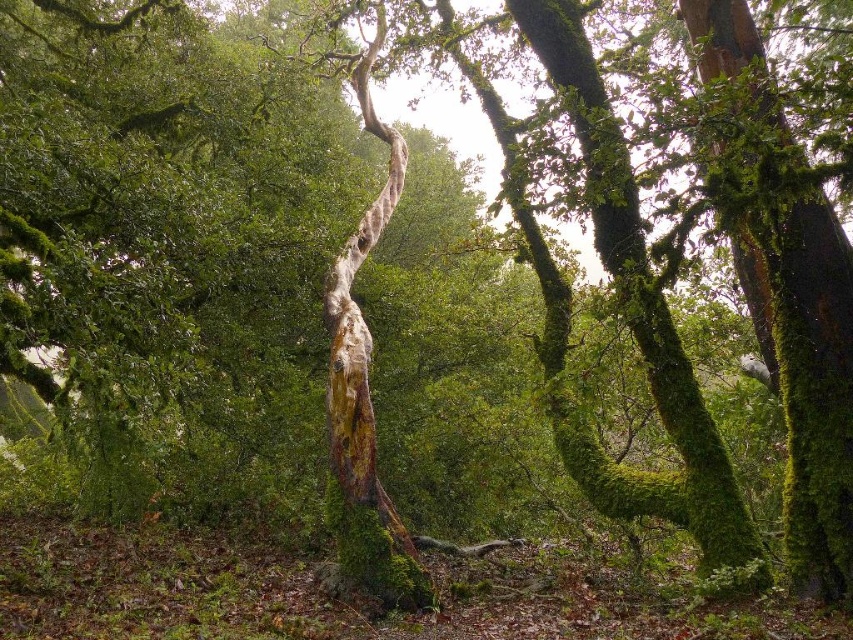
Is point (811, 221) farther from camera compared to point (577, 83)?

No, (811, 221) is in front of (577, 83).

Based on the photo, can you confirm if green mossy tree trunk at right is positioned to the left of green mossy tree trunk at upper right?

Incorrect, green mossy tree trunk at right is not on the left side of green mossy tree trunk at upper right.

Between point (746, 28) and point (584, 86), which one is positioned in front?

Point (584, 86) is in front.

This screenshot has height=640, width=853. In order to click on green mossy tree trunk at right in this screenshot , I will do `click(795, 307)`.